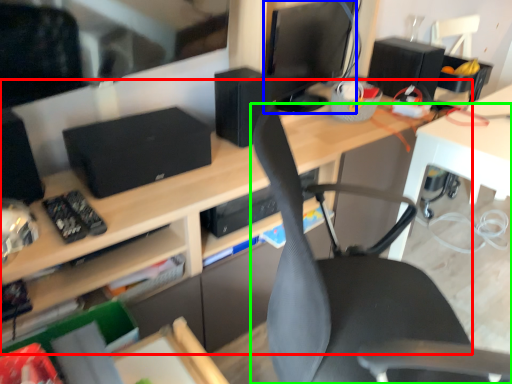
Question: Based on their relative distances, which object is farther from desk (highlighted by a red box)? Choose from computer monitor (highlighted by a blue box) and chair (highlighted by a green box).

Choices:
 (A) computer monitor
 (B) chair

Answer: (A)